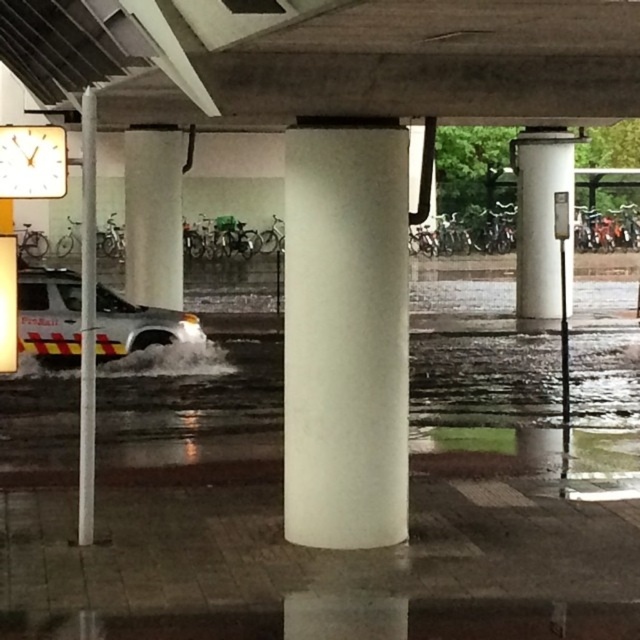
Does point (179, 248) lie behind point (531, 248)?

That is False.

Locate an element on the screen. smooth concrete pillar at center is located at coordinates (154, 214).

Image resolution: width=640 pixels, height=640 pixels. Identify the location of smooth concrete pillar at center. (154, 214).

Which is in front, point (406, 332) or point (131, 148)?

Positioned in front is point (406, 332).

Does point (349, 451) lie in front of point (173, 280)?

Yes, it is.

At what (x,y) coordinates should I click in order to perform the action: click on white smooth column at center. Please return your answer as a coordinate pair (x, y). Looking at the image, I should click on (346, 336).

Does concrete at center appear over white smooth column at center?

Correct, concrete at center is located above white smooth column at center.

Where is `concrete at center`? The height and width of the screenshot is (640, 640). concrete at center is located at coordinates (332, 58).

Measure the distance between point (51,6) and camera.

7.38 meters

Identify the location of concrete at center. (332, 58).